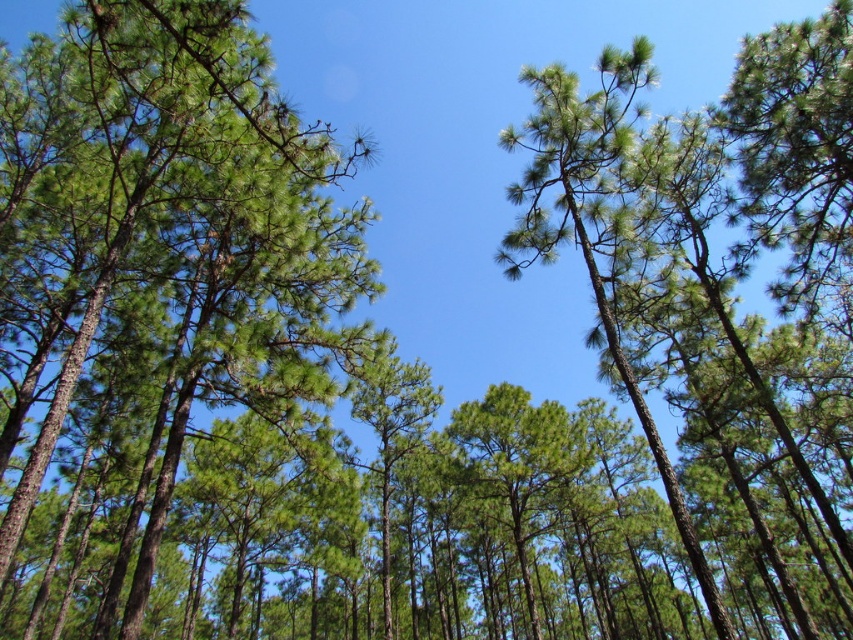
Who is taller, green needle-like at center or green needle-like at upper center?

green needle-like at center

Does green needle-like at center appear on the right side of green needle-like at upper center?

No, green needle-like at center is not to the right of green needle-like at upper center.

Between point (73, 365) and point (546, 211), which one is positioned behind?

The point (546, 211) is more distant.

Where is `green needle-like at center`? Image resolution: width=853 pixels, height=640 pixels. green needle-like at center is located at coordinates (160, 259).